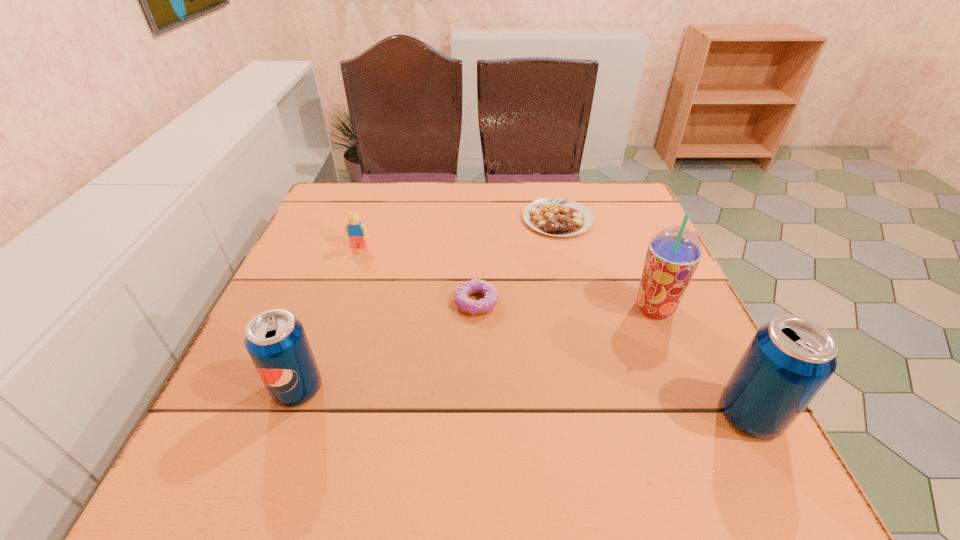
Where is `steak present at the right edge`? This screenshot has width=960, height=540. steak present at the right edge is located at coordinates (559, 217).

The image size is (960, 540). I want to click on smoothie present at the right edge, so pos(673,254).

This screenshot has width=960, height=540. Identify the location of object positioned at the near left corner. (276, 341).

In order to click on object situated at the far right corner in this screenshot , I will do `click(559, 217)`.

The height and width of the screenshot is (540, 960). Find the location of `object that is at the near right corner`. object that is at the near right corner is located at coordinates (788, 361).

Image resolution: width=960 pixels, height=540 pixels. Identify the location of free space at the far edge of the desktop. (573, 193).

What are the coordinates of `free location at the left edge` in the screenshot? It's located at (x=342, y=251).

Find the location of `vacant space at the right edge of the desktop`. vacant space at the right edge of the desktop is located at coordinates (636, 270).

Find the location of a particular element. The image size is (960, 540). free space at the far left corner of the desktop is located at coordinates (355, 198).

Find the location of a particular element. This screenshot has height=540, width=960. vacant space at the far right corner of the desktop is located at coordinates (618, 201).